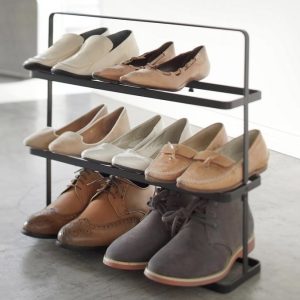
Locate an element on the screen. The image size is (300, 300). shoes on the top shelf is located at coordinates (41, 58), (72, 64), (110, 74), (138, 77).